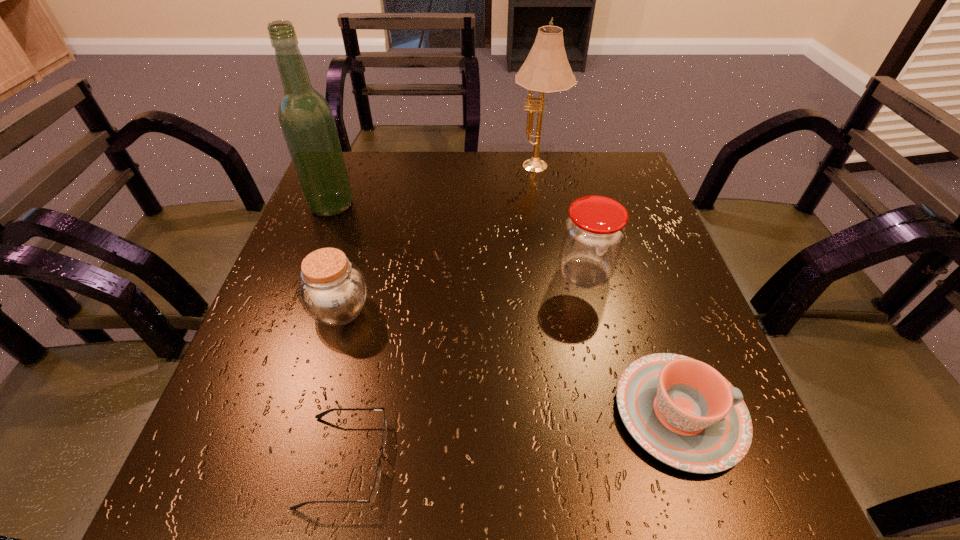
Image resolution: width=960 pixels, height=540 pixels. In the image, there is a desktop. Find the location of `vacant space at the far right corner`. vacant space at the far right corner is located at coordinates (597, 159).

I want to click on vacant space in between the second shortest object and the left jar, so click(x=510, y=362).

Find the location of a particular element. This screenshot has height=540, width=960. free area in between the liquor and the farthest object is located at coordinates (434, 187).

The height and width of the screenshot is (540, 960). I want to click on vacant area that lies between the chinaware and the farthest object, so click(x=608, y=291).

You are a GUI agent. You are given a task and a screenshot of the screen. Output one action in this format:
    pyautogui.click(x=<x>, y=<y>)
    Task: Click on the vacant area between the shorter jar and the shortest object
    
    Given the screenshot: What is the action you would take?
    pyautogui.click(x=343, y=386)

Where is `free space between the farthest object and the liquor`? free space between the farthest object and the liquor is located at coordinates (434, 187).

The image size is (960, 540). Find the location of `free spot between the spectacles and the fifth nearest object`. free spot between the spectacles and the fifth nearest object is located at coordinates (338, 333).

Where is `free space between the fourth tallest object and the farthest object`? The height and width of the screenshot is (540, 960). free space between the fourth tallest object and the farthest object is located at coordinates (439, 240).

Where is `free point between the shorter jar and the third tallest object`? The image size is (960, 540). free point between the shorter jar and the third tallest object is located at coordinates (462, 293).

The height and width of the screenshot is (540, 960). I want to click on empty space that is in between the second farthest object and the lampshade, so click(x=434, y=187).